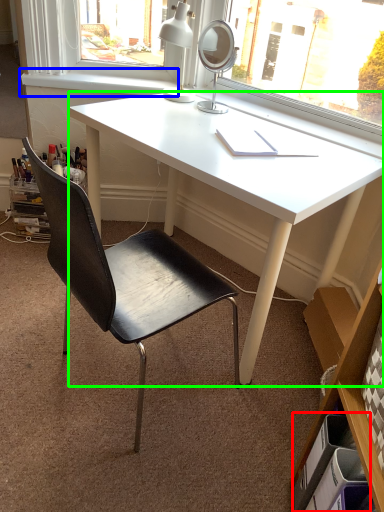
Question: Considering the real-world distances, which object is farthest from drawer (highlighted by a red box)? window sill (highlighted by a blue box) or desk (highlighted by a green box)?

Choices:
 (A) window sill
 (B) desk

Answer: (A)